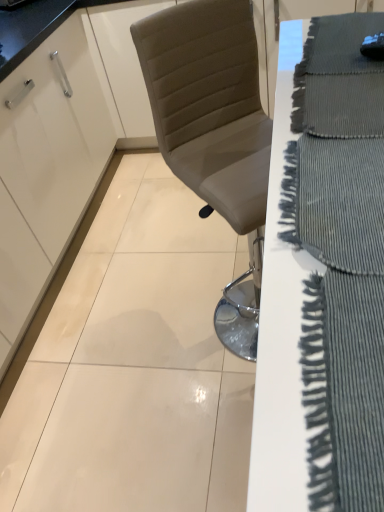
The image size is (384, 512). In order to click on white glossy table at center in this screenshot , I will do `click(323, 277)`.

This screenshot has width=384, height=512. Describe the element at coordinates (323, 277) in the screenshot. I see `white glossy table at center` at that location.

Locate an element on the screen. The width and height of the screenshot is (384, 512). white glossy table at center is located at coordinates (323, 277).